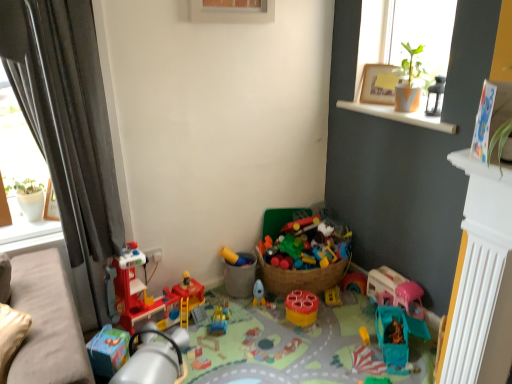
Locate an element on the screen. free location in front of matte yellow plastic toy at center, acting as the fourth toy starting from the left is located at coordinates (239, 305).